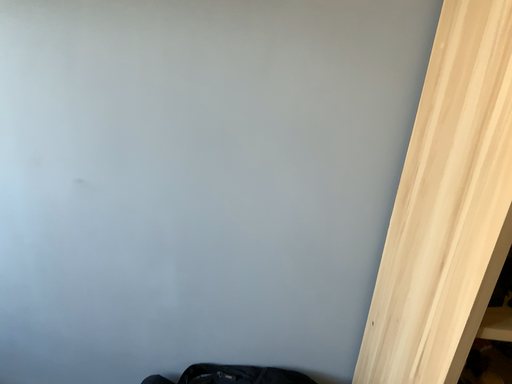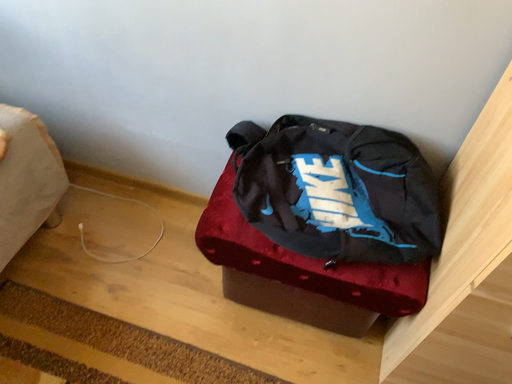
Question: Which way did the camera rotate in the video?

Choices:
 (A) rotated right
 (B) rotated left

Answer: (B)